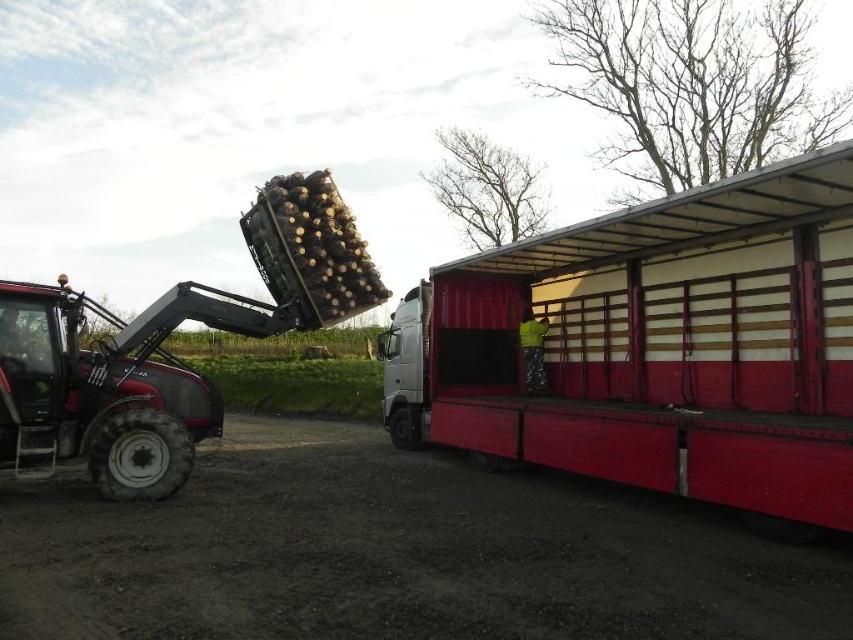
Question: In this image, where is metallic red truck at center located relative to matte black tractor at left?

Choices:
 (A) right
 (B) left

Answer: (A)

Question: Which object appears closest to the camera in this image?

Choices:
 (A) matte black tractor at left
 (B) metallic red truck at center

Answer: (B)

Question: In this image, where is metallic red truck at center located relative to matte black tractor at left?

Choices:
 (A) right
 (B) left

Answer: (A)

Question: Which point appears closest to the camera in this image?

Choices:
 (A) tap(444, 362)
 (B) tap(78, 298)

Answer: (B)

Question: Is the position of metallic red truck at center more distant than that of matte black tractor at left?

Choices:
 (A) no
 (B) yes

Answer: (A)